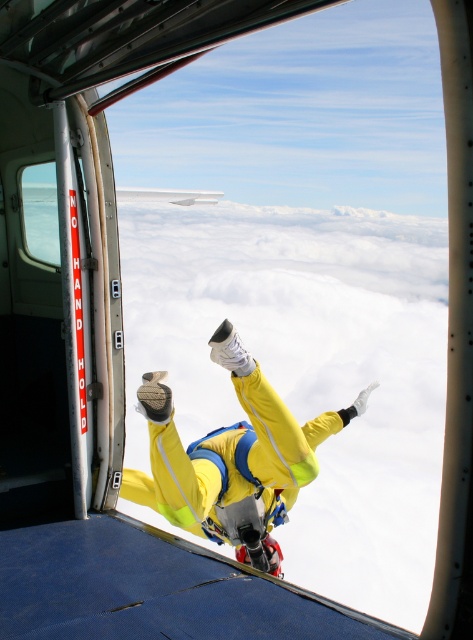
Question: Which object appears farthest from the camera in this image?

Choices:
 (A) yellow fabric suit at center
 (B) transparent glass airplane window at left

Answer: (B)

Question: Can you confirm if yellow fabric suit at center is positioned to the left of transparent glass airplane window at left?

Choices:
 (A) no
 (B) yes

Answer: (A)

Question: Is yellow fabric suit at center below transparent glass airplane window at left?

Choices:
 (A) no
 (B) yes

Answer: (B)

Question: Does yellow fabric suit at center appear under transparent glass airplane window at left?

Choices:
 (A) yes
 (B) no

Answer: (A)

Question: Which point is closer to the camera?

Choices:
 (A) tap(224, 522)
 (B) tap(35, 209)

Answer: (A)